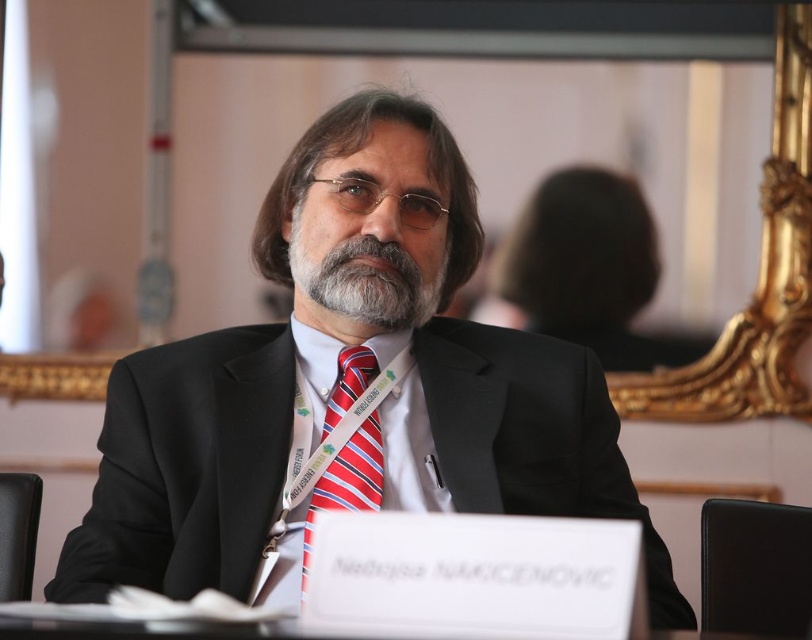
You are a photographer adjusting the camera focus. You need to ensure both the gray matte beard at center and the striped fabric tie at center are in focus. Which object should you adjust the focus to first to ensure the wider one is sharp?

The gray matte beard at center has a larger width than the striped fabric tie at center, so you should focus on the gray matte beard at center first to ensure its wider area is sharp before adjusting for the narrower tie.

You are a photographer standing at a distance of 1.5 meters from the subject in the image. You want to take a closeup shot of the gray matte beard at center. Is the beard within your camera lens focal range if your camera has a maximum focal length of 1.4 meters?

The gray matte beard at center is 1.40 meters from the camera. Since your camera has a maximum focal length of 1.4 meters, the beard is exactly at the edge of the focal range. Therefore, you can capture the gray matte beard at center within the frame by adjusting the focus to the maximum focal length.